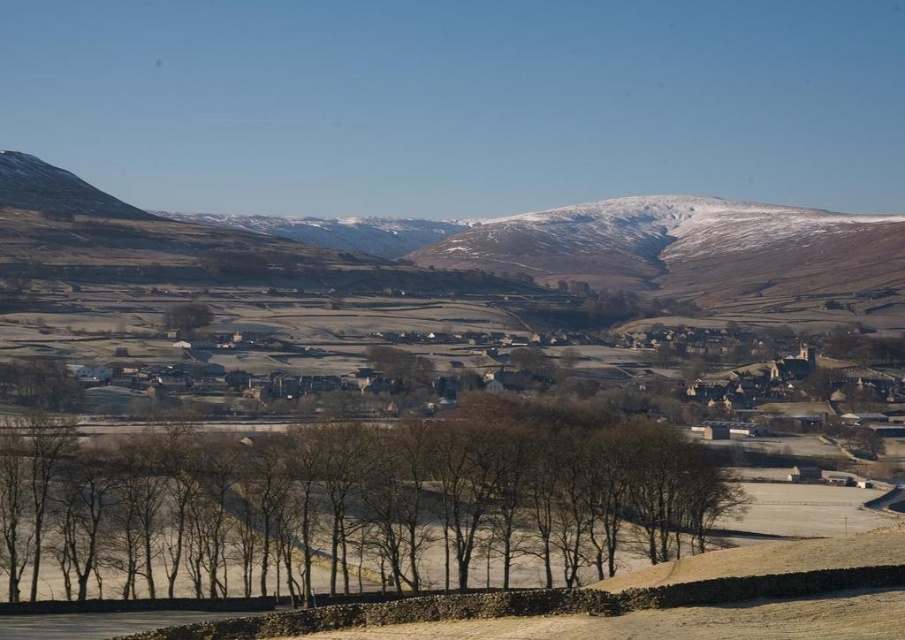
Question: Does bare branches at center appear on the left side of snow-covered mountain at left?

Choices:
 (A) yes
 (B) no

Answer: (A)

Question: Is snow-covered mountain at left bigger than brown textured tree at center?

Choices:
 (A) yes
 (B) no

Answer: (A)

Question: Which is farther from the snow-covered mountain at center?

Choices:
 (A) snow-covered mountain at left
 (B) brown textured tree at center

Answer: (B)

Question: Which is farther from the snow-covered mountain at left?

Choices:
 (A) snow-covered mountain at center
 (B) bare branches at center

Answer: (B)

Question: Which object is the closest to the snow-covered mountain at left?

Choices:
 (A) bare branches at center
 (B) brown textured tree at center
 (C) snow-covered mountain at center

Answer: (C)

Question: Does bare branches at center have a smaller size compared to snow-covered mountain at center?

Choices:
 (A) yes
 (B) no

Answer: (A)